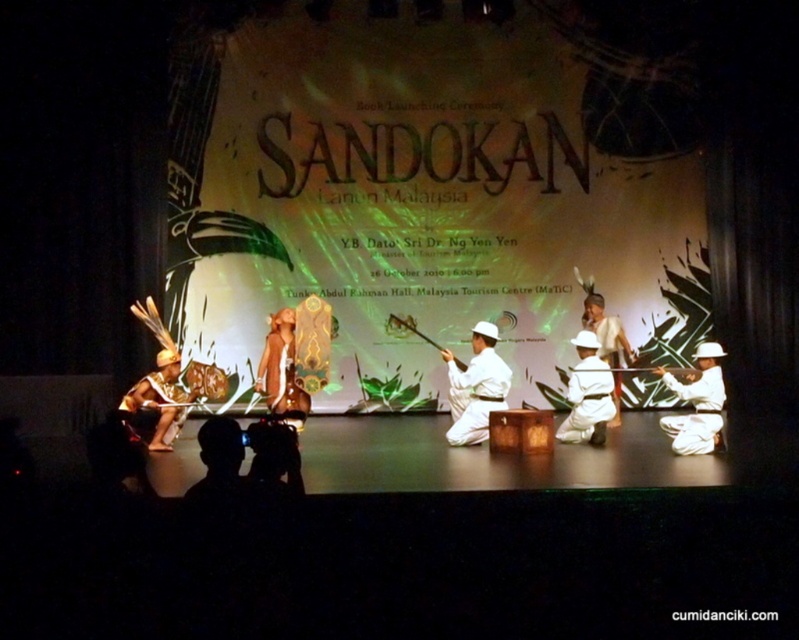
Between matte gold helmet at lower left and leather-like brown dress at center, which one has less height?

With less height is matte gold helmet at lower left.

Does point (177, 417) come in front of point (283, 385)?

Yes.

What are the coordinates of `matte gold helmet at lower left` in the screenshot? It's located at (158, 401).

Identify the location of matte gold helmet at lower left. The width and height of the screenshot is (799, 640). (158, 401).

Does matte gold helmet at lower left appear over white matte/soft fabric at center?

Incorrect, matte gold helmet at lower left is not positioned above white matte/soft fabric at center.

Is matte gold helmet at lower left to the right of white matte/soft fabric at center from the viewer's perspective?

No, matte gold helmet at lower left is not to the right of white matte/soft fabric at center.

Does point (169, 449) lie behind point (583, 305)?

No.

In order to click on matte gold helmet at lower left in this screenshot , I will do `click(158, 401)`.

Does white matte kimono at center appear over white matte helmet at center?

No, white matte kimono at center is not above white matte helmet at center.

Between point (448, 444) and point (674, 380), which one is positioned in front?

Point (674, 380) is more forward.

Is point (495, 326) positioned in front of point (712, 417)?

No, (495, 326) is behind (712, 417).

What are the coordinates of `white matte kimono at center` in the screenshot? It's located at (475, 387).